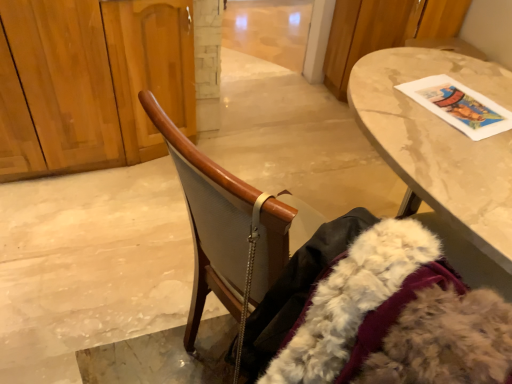
Locate an element on the screen. The width and height of the screenshot is (512, 384). vacant area that is situated to the right of wooden dresser at left is located at coordinates (252, 151).